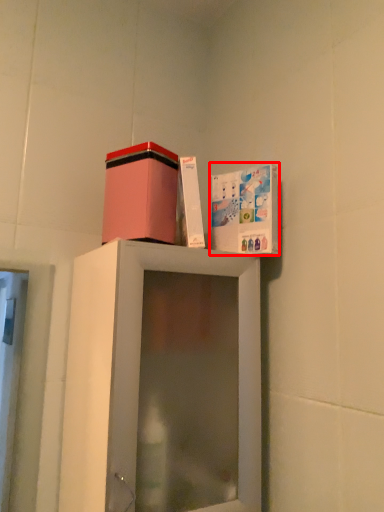
Question: From the image's perspective, considering the relative positions of cabinet (annotated by the red box) and cardboard box in the image provided, where is cabinet (annotated by the red box) located with respect to the staircase?

Choices:
 (A) below
 (B) above

Answer: (A)